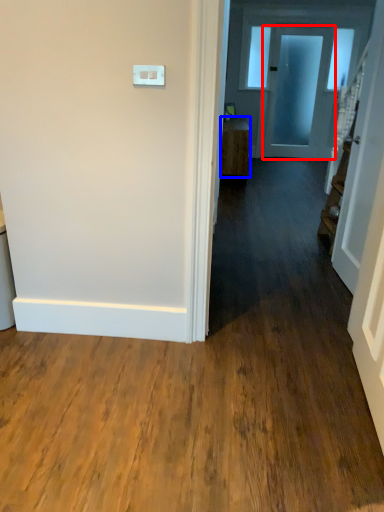
Question: Which of the following is the farthest to the observer, door (highlighted by a red box) or furniture (highlighted by a blue box)?

Choices:
 (A) door
 (B) furniture

Answer: (A)